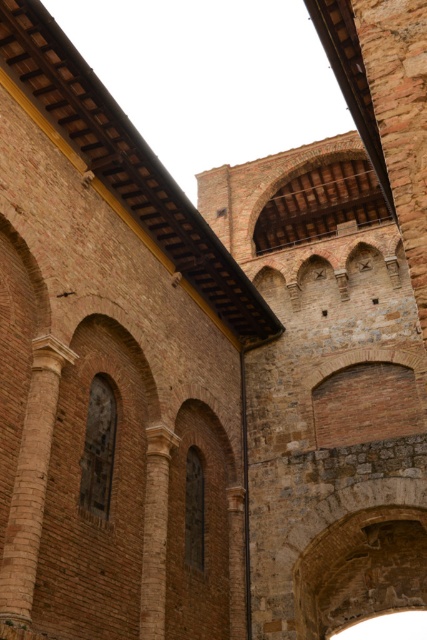
Between point (43, 340) and point (239, 580), which one is positioned in front?

Positioned in front is point (43, 340).

Can you confirm if smooth tan stone column at left is wider than brown stone pillar at center?

Yes.

Between point (26, 532) and point (233, 522), which one is positioned behind?

Positioned behind is point (233, 522).

This screenshot has height=640, width=427. What are the coordinates of `smooth tan stone column at left` in the screenshot? It's located at (31, 483).

Who is taller, smooth tan stone column at left or brown rough stone pillar at center?

With more height is smooth tan stone column at left.

Between point (55, 378) and point (163, 458), which one is positioned behind?

The point (163, 458) is behind.

You are a GUI agent. You are given a task and a screenshot of the screen. Output one action in this format:
    pyautogui.click(x=<x>, y=<y>)
    Task: Click on the smooth tan stone column at left
    
    Given the screenshot: What is the action you would take?
    pyautogui.click(x=31, y=483)

Does brown rough stone pillar at center have a larger size compared to brown stone pillar at center?

Correct, brown rough stone pillar at center is larger in size than brown stone pillar at center.

Image resolution: width=427 pixels, height=640 pixels. Describe the element at coordinates (155, 531) in the screenshot. I see `brown rough stone pillar at center` at that location.

Where is `brown rough stone pillar at center`? The width and height of the screenshot is (427, 640). brown rough stone pillar at center is located at coordinates (155, 531).